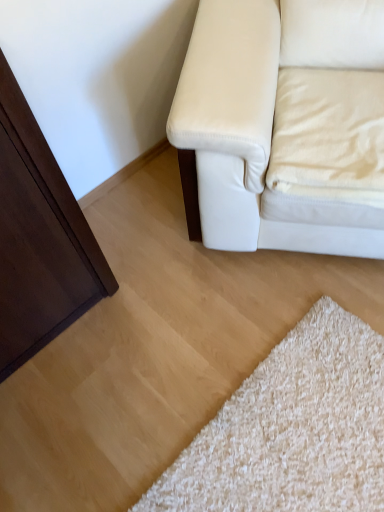
Describe the element at coordinates (286, 124) in the screenshot. I see `matte white leather couch at upper right` at that location.

Identify the location of matte white leather couch at upper right. The width and height of the screenshot is (384, 512). (286, 124).

What do you see at coordinates (329, 135) in the screenshot?
I see `beige fabric pillow at upper right` at bounding box center [329, 135].

Find the location of `beige fabric pillow at upper right`. beige fabric pillow at upper right is located at coordinates (329, 135).

Identify the location of matte white leather couch at upper right. (286, 124).

Between matte white leather couch at upper right and beige fabric pillow at upper right, which one appears on the right side from the viewer's perspective?

Positioned to the right is beige fabric pillow at upper right.

Between matte white leather couch at upper right and beige fabric pillow at upper right, which one is positioned behind?

beige fabric pillow at upper right is more distant.

Considering the positions of points (317, 210) and (357, 78), is point (317, 210) closer to camera compared to point (357, 78)?

Yes, it is in front of point (357, 78).

From the image's perspective, relative to beige fabric pillow at upper right, is matte white leather couch at upper right above or below?

From the image's perspective, matte white leather couch at upper right appears above beige fabric pillow at upper right.

From a real-world perspective, is matte white leather couch at upper right under beige fabric pillow at upper right?

Actually, matte white leather couch at upper right is physically above beige fabric pillow at upper right in the real world.

Can you confirm if matte white leather couch at upper right is wider than beige fabric pillow at upper right?

Correct, the width of matte white leather couch at upper right exceeds that of beige fabric pillow at upper right.

Considering the sizes of matte white leather couch at upper right and beige fabric pillow at upper right in the image, is matte white leather couch at upper right taller or shorter than beige fabric pillow at upper right?

matte white leather couch at upper right is taller than beige fabric pillow at upper right.

Who is smaller, matte white leather couch at upper right or beige fabric pillow at upper right?

With smaller size is beige fabric pillow at upper right.

Can we say matte white leather couch at upper right lies outside beige fabric pillow at upper right?

matte white leather couch at upper right is positioned outside beige fabric pillow at upper right.

Is matte white leather couch at upper right directly adjacent to beige fabric pillow at upper right?

Yes.

Is matte white leather couch at upper right turned away from beige fabric pillow at upper right?

Yes, matte white leather couch at upper right is positioned with its back facing beige fabric pillow at upper right.

The image size is (384, 512). Find the location of `pillow behind the matte white leather couch at upper right`. pillow behind the matte white leather couch at upper right is located at coordinates (329, 135).

Which object is positioned more to the right, beige fabric pillow at upper right or matte white leather couch at upper right?

beige fabric pillow at upper right is more to the right.

Is beige fabric pillow at upper right positioned behind matte white leather couch at upper right?

Yes, beige fabric pillow at upper right is behind matte white leather couch at upper right.

Is point (299, 120) positioned behind point (282, 142)?

That is True.

From the image's perspective, is beige fabric pillow at upper right over matte white leather couch at upper right?

No.

From a real-world perspective, relative to matte white leather couch at upper right, is beige fabric pillow at upper right vertically above or below?

beige fabric pillow at upper right is situated lower than matte white leather couch at upper right in the real world.

Does beige fabric pillow at upper right have a lesser width compared to matte white leather couch at upper right?

Indeed, beige fabric pillow at upper right has a lesser width compared to matte white leather couch at upper right.

Who is shorter, beige fabric pillow at upper right or matte white leather couch at upper right?

With less height is beige fabric pillow at upper right.

Does beige fabric pillow at upper right have a smaller size compared to matte white leather couch at upper right?

Indeed, beige fabric pillow at upper right has a smaller size compared to matte white leather couch at upper right.

Is matte white leather couch at upper right a part of beige fabric pillow at upper right?

No.

Is beige fabric pillow at upper right beside matte white leather couch at upper right?

Yes, beige fabric pillow at upper right is with matte white leather couch at upper right.

Is beige fabric pillow at upper right aimed at matte white leather couch at upper right?

Yes, beige fabric pillow at upper right is turned towards matte white leather couch at upper right.

What's the angular difference between beige fabric pillow at upper right and matte white leather couch at upper right's facing directions?

There is a 6.56e-06-degree angle between the facing directions of beige fabric pillow at upper right and matte white leather couch at upper right.

Image resolution: width=384 pixels, height=512 pixels. In order to click on pillow below the matte white leather couch at upper right (from the image's perspective) in this screenshot , I will do `click(329, 135)`.

This screenshot has width=384, height=512. What are the coordinates of `pillow behind the matte white leather couch at upper right` in the screenshot? It's located at (329, 135).

The image size is (384, 512). I want to click on studio couch that is in front of the beige fabric pillow at upper right, so click(x=286, y=124).